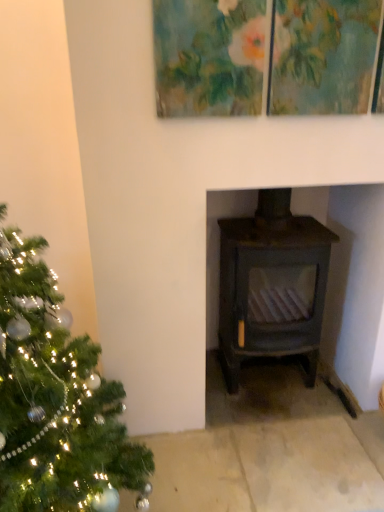
Identify the location of green matte christmas tree at left. This screenshot has width=384, height=512. (56, 399).

What do you see at coordinates (56, 399) in the screenshot? The width and height of the screenshot is (384, 512). I see `green matte christmas tree at left` at bounding box center [56, 399].

What is the approximate width of green matte christmas tree at left?

It is 34.26 inches.

Where is `green matte christmas tree at left`? The width and height of the screenshot is (384, 512). green matte christmas tree at left is located at coordinates (56, 399).